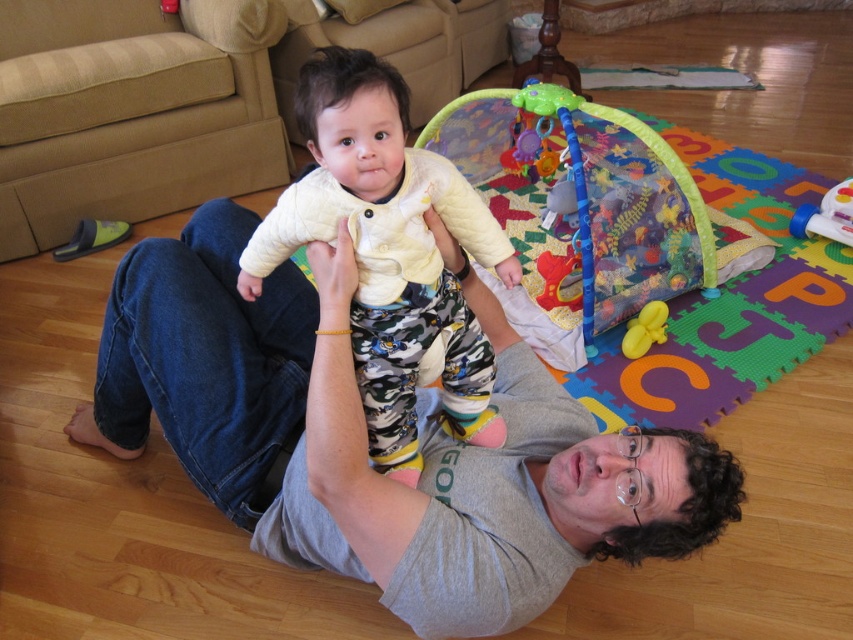
Is point (573, 200) more distant than point (802, 216)?

No, (573, 200) is in front of (802, 216).

Is multicolored foam mat at center below translucent plastic toy at upper right?

Actually, multicolored foam mat at center is above translucent plastic toy at upper right.

Between point (727, 148) and point (845, 211), which one is positioned behind?

Point (727, 148)

Identify the location of multicolored foam mat at center. This screenshot has width=853, height=640. coord(698,269).

Is point (653, 252) positioned after point (659, 324)?

Yes, it is behind point (659, 324).

Does multicolored foam mat at center come in front of yellow rubber duck at center?

Yes, multicolored foam mat at center is in front of yellow rubber duck at center.

Does point (502, 120) lie behind point (666, 314)?

Yes.

Image resolution: width=853 pixels, height=640 pixels. I want to click on multicolored foam mat at center, so click(x=698, y=269).

How far apart are gray cotton shirt at center and yellow rubber duck at center?

1.01 meters

Does gray cotton shirt at center appear over yellow rubber duck at center?

No, gray cotton shirt at center is not above yellow rubber duck at center.

Which is behind, point (680, 525) or point (643, 340)?

Positioned behind is point (643, 340).

The height and width of the screenshot is (640, 853). What are the coordinates of `gray cotton shirt at center` in the screenshot? It's located at (364, 440).